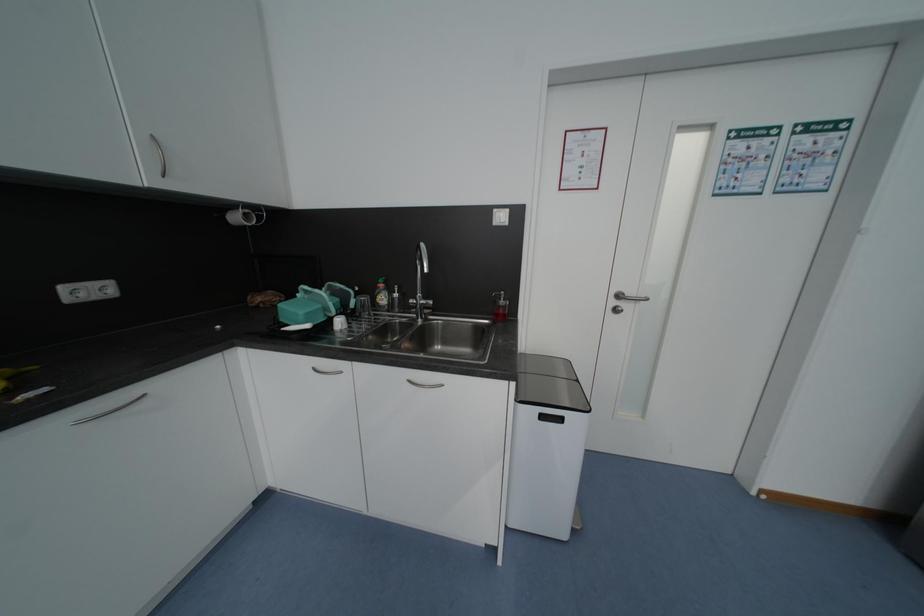
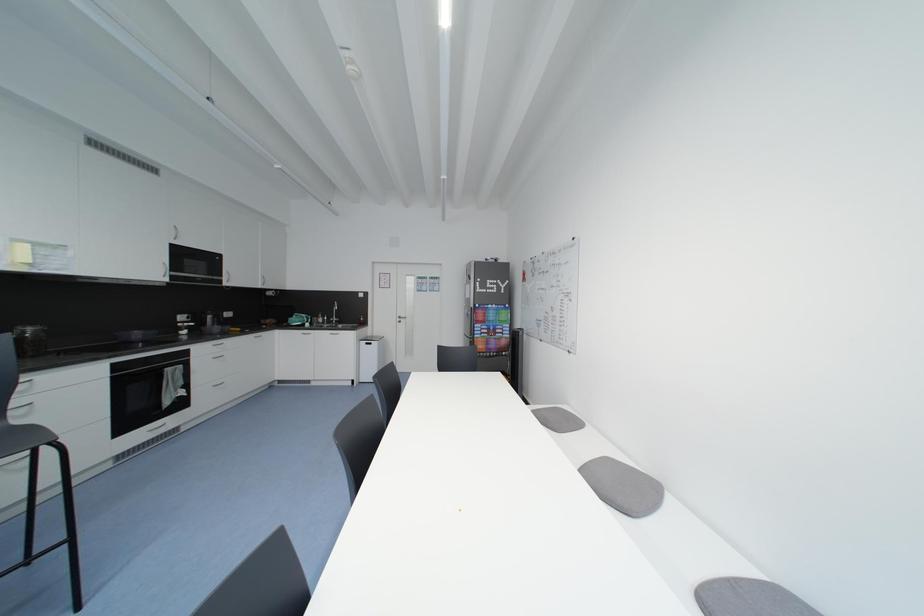
Question: The images are taken continuously from a first-person perspective. In which direction are you moving?

Choices:
 (A) Left
 (B) Right
 (C) Forward
 (D) Backward

Answer: (D)